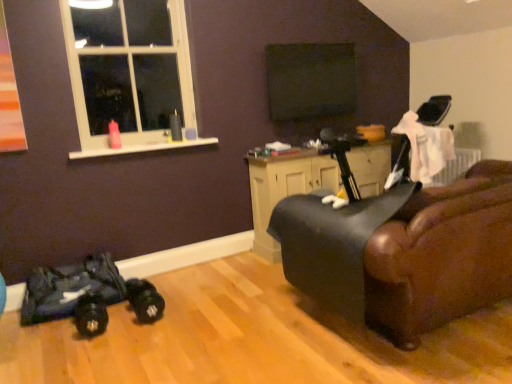
I want to click on black matte screen at upper center, so click(310, 80).

What do you see at coordinates (285, 189) in the screenshot?
I see `matte black cabinet at center` at bounding box center [285, 189].

This screenshot has height=384, width=512. Find the location of `white plastic window at upper left`. white plastic window at upper left is located at coordinates (129, 72).

Locate an element on the screen. This screenshot has width=512, height=384. black matte screen at upper center is located at coordinates (310, 80).

From the image's perspective, is black leather chair at right located above black matte screen at upper center?

Incorrect, from the image's perspective, black leather chair at right is lower than black matte screen at upper center.

What's the angular difference between black leather chair at right and black matte screen at upper center's facing directions?

They differ by 180 degrees in their facing directions.

Which of these two, black leather chair at right or black matte screen at upper center, stands taller?

With more height is black leather chair at right.

Considering the relative sizes of black leather chair at right and black matte screen at upper center in the image provided, is black leather chair at right bigger than black matte screen at upper center?

Correct, black leather chair at right is larger in size than black matte screen at upper center.

Which object is thinner, matte black cabinet at center or black leather chair at right?

With smaller width is matte black cabinet at center.

Is black leather chair at right surrounded by matte black cabinet at center?

No, matte black cabinet at center does not contain black leather chair at right.

Is matte black cabinet at center to the left of black leather chair at right from the viewer's perspective?

Indeed, matte black cabinet at center is positioned on the left side of black leather chair at right.

Who is bigger, matte black cabinet at center or black leather chair at right?

black leather chair at right is bigger.

How much distance is there between black matte screen at upper center and black leather swivel chair at right?

A distance of 1.56 meters exists between black matte screen at upper center and black leather swivel chair at right.

Is black matte screen at upper center shorter than black leather swivel chair at right?

Yes.

In the image, there is a black matte screen at upper center. Identify the location of swivel chair below it (from a real-world perspective). (332, 244).

Can you see black matte screen at upper center touching black leather swivel chair at right?

They are not placed beside each other.

Is matte black cabinet at center positioned before black matte screen at upper center?

Yes, it is.

Is matte black cabinet at center outside of black matte screen at upper center?

Absolutely, matte black cabinet at center is external to black matte screen at upper center.

Does matte black cabinet at center have a greater width compared to black matte screen at upper center?

Yes.

At what (x,y) coordinates should I click in order to perform the action: click on cabinetry below the black matte screen at upper center (from a real-world perspective). Please return your answer as a coordinate pair (x, y). Looking at the image, I should click on (285, 189).

Considering the relative sizes of black matte screen at upper center and black leather chair at right in the image provided, is black matte screen at upper center wider than black leather chair at right?

No.

Considering the positions of objects black matte screen at upper center and black leather chair at right in the image provided, who is more to the left, black matte screen at upper center or black leather chair at right?

From the viewer's perspective, black matte screen at upper center appears more on the left side.

Is black matte screen at upper center positioned beyond the bounds of black leather chair at right?

Yes, black matte screen at upper center is outside of black leather chair at right.

Who is shorter, black matte screen at upper center or black leather chair at right?

With less height is black matte screen at upper center.

Is white plastic window at upper left facing away from black leather swivel chair at right?

No, white plastic window at upper left is not facing the opposite direction of black leather swivel chair at right.

Is white plastic window at upper left at the left side of black leather swivel chair at right?

Correct, you'll find white plastic window at upper left to the left of black leather swivel chair at right.

From the picture: Measure the distance from white plastic window at upper left to black leather swivel chair at right.

white plastic window at upper left is 1.59 meters from black leather swivel chair at right.

From a real-world perspective, is white plastic window at upper left above or below black leather swivel chair at right?

white plastic window at upper left is situated higher than black leather swivel chair at right in the real world.

Can you tell me how much white plastic window at upper left and black matte screen at upper center differ in facing direction?

white plastic window at upper left and black matte screen at upper center are facing 0.255 degrees away from each other.

Is white plastic window at upper left oriented towards black matte screen at upper center?

No, white plastic window at upper left is not turned towards black matte screen at upper center.

Is white plastic window at upper left far away from black matte screen at upper center?

Indeed, white plastic window at upper left is not near black matte screen at upper center.

You are a GUI agent. You are given a task and a screenshot of the screen. Output one action in this format:
    pyautogui.click(x=<x>, y=<y>)
    Task: Click on the window screen that is above the black leather chair at right (from the image's perspective)
    
    Given the screenshot: What is the action you would take?
    tap(310, 80)

Locate an element on the screen. cabinetry behind the black leather chair at right is located at coordinates (285, 189).

When comparing their distances from white plastic window at upper left, does matte black cabinet at center or black leather swivel chair at right seem closer?

matte black cabinet at center is closer to white plastic window at upper left.

Which object lies further to the anchor point matte black cabinet at center, black matte screen at upper center or white plastic window at upper left?

white plastic window at upper left is further to matte black cabinet at center.

From the image, which object appears to be nearer to matte black cabinet at center, black leather swivel chair at right or black leather chair at right?

The object closer to matte black cabinet at center is black leather swivel chair at right.

Looking at this image, when comparing their distances from black leather swivel chair at right, does black leather chair at right or black matte screen at upper center seem further?

Based on the image, black matte screen at upper center appears to be further to black leather swivel chair at right.

Based on the photo, estimate the real-world distances between objects in this image. Which object is closer to matte black cabinet at center, black leather chair at right or black matte screen at upper center?

black matte screen at upper center.

When comparing their distances from black leather swivel chair at right, does white plastic window at upper left or black leather chair at right seem closer?

The object closer to black leather swivel chair at right is black leather chair at right.

Considering their positions, is black leather swivel chair at right positioned further to black leather chair at right than white plastic window at upper left?

The object further to black leather chair at right is white plastic window at upper left.

Estimate the real-world distances between objects in this image. Which object is further from white plastic window at upper left, black leather swivel chair at right or black leather chair at right?

black leather chair at right is further to white plastic window at upper left.

Find the location of a particular element. window screen between white plastic window at upper left and black leather chair at right in the horizontal direction is located at coordinates (310, 80).

The height and width of the screenshot is (384, 512). I want to click on cabinetry between black leather swivel chair at right and black matte screen at upper center along the z-axis, so click(285, 189).

Image resolution: width=512 pixels, height=384 pixels. Find the location of `swivel chair between black leather chair at right and black matte screen at upper center along the z-axis`. swivel chair between black leather chair at right and black matte screen at upper center along the z-axis is located at coordinates (332, 244).

Identify the location of swivel chair between white plastic window at upper left and black leather chair at right in the horizontal direction. (332, 244).